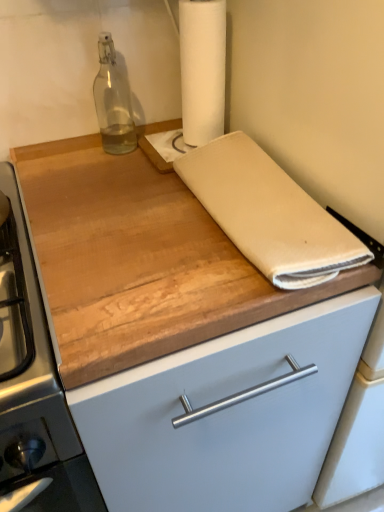
The width and height of the screenshot is (384, 512). In order to click on white paper towel at upper center in this screenshot , I will do `click(202, 69)`.

What do you see at coordinates (202, 69) in the screenshot?
I see `white paper towel at upper center` at bounding box center [202, 69].

What do you see at coordinates (269, 214) in the screenshot? This screenshot has width=384, height=512. I see `beige cotton towel at center` at bounding box center [269, 214].

The height and width of the screenshot is (512, 384). Identify the location of wooden cutting board at center. (139, 260).

Is transparent glass bottle at upper left surrounding wooden cutting board at center?

No, wooden cutting board at center is not surrounded by transparent glass bottle at upper left.

In the scene shown: From the image's perspective, is transparent glass bottle at upper left located above wooden cutting board at center?

Yes, from the image's perspective, transparent glass bottle at upper left is above wooden cutting board at center.

At what (x,y) coordinates should I click in order to perform the action: click on bottle to the left of wooden cutting board at center. Please return your answer as a coordinate pair (x, y). This screenshot has height=512, width=384. Looking at the image, I should click on (113, 101).

Consider the image. Considering their positions, is transparent glass bottle at upper left located in front of or behind wooden cutting board at center?

transparent glass bottle at upper left is positioned farther from the viewer than wooden cutting board at center.

Which object is positioned more to the left, transparent glass bottle at upper left or white paper towel at upper center?

transparent glass bottle at upper left.

From the image's perspective, relative to white paper towel at upper center, is transparent glass bottle at upper left above or below?

transparent glass bottle at upper left is below white paper towel at upper center.

Is transparent glass bottle at upper left positioned beyond the bounds of white paper towel at upper center?

That's correct, transparent glass bottle at upper left is outside of white paper towel at upper center.

Is transparent glass bottle at upper left with white paper towel at upper center?

No, transparent glass bottle at upper left is not next to white paper towel at upper center.

Is transparent glass bottle at upper left looking in the opposite direction of beige cotton towel at center?

transparent glass bottle at upper left is not turned away from beige cotton towel at center.

Is transparent glass bottle at upper left thinner than beige cotton towel at center?

Yes.

How far apart are transparent glass bottle at upper left and beige cotton towel at center?

transparent glass bottle at upper left and beige cotton towel at center are 14.42 inches apart.

Who is bigger, transparent glass bottle at upper left or beige cotton towel at center?

beige cotton towel at center is bigger.

Where is `linen on the right of the white paper towel at upper center`? The image size is (384, 512). linen on the right of the white paper towel at upper center is located at coordinates (269, 214).

Considering the sizes of objects beige cotton towel at center and white paper towel at upper center in the image provided, who is smaller, beige cotton towel at center or white paper towel at upper center?

Smaller between the two is white paper towel at upper center.

Is beige cotton towel at center spatially inside white paper towel at upper center, or outside of it?

beige cotton towel at center exists outside the volume of white paper towel at upper center.

Is beige cotton towel at center not close to wooden cutting board at center?

No.

Could you tell me if beige cotton towel at center is turned towards wooden cutting board at center?

Yes, beige cotton towel at center is turned towards wooden cutting board at center.

Considering the relative positions of beige cotton towel at center and wooden cutting board at center in the image provided, is beige cotton towel at center behind wooden cutting board at center?

Yes, it is.

From the picture: Which is closer, (199,22) or (307,281)?

Point (199,22).

Where is `paper towel on the left of the beige cotton towel at center`? This screenshot has width=384, height=512. paper towel on the left of the beige cotton towel at center is located at coordinates (202, 69).

Which object is positioned more to the left, white paper towel at upper center or beige cotton towel at center?

Positioned to the left is white paper towel at upper center.

From the image's perspective, which is below, white paper towel at upper center or beige cotton towel at center?

From the image's view, beige cotton towel at center is below.

Is white paper towel at upper center at the left side of wooden cutting board at center?

Incorrect, white paper towel at upper center is not on the left side of wooden cutting board at center.

Identify the location of countertop on the left of white paper towel at upper center. The image size is (384, 512). (139, 260).

Considering the sizes of objects white paper towel at upper center and wooden cutting board at center in the image provided, who is thinner, white paper towel at upper center or wooden cutting board at center?

white paper towel at upper center is thinner.

Between point (212, 100) and point (161, 210), which one is positioned in front?

Positioned in front is point (161, 210).

The height and width of the screenshot is (512, 384). I want to click on countertop in front of the transparent glass bottle at upper left, so click(x=139, y=260).

This screenshot has height=512, width=384. I want to click on bottle that is on the left side of white paper towel at upper center, so click(x=113, y=101).

Based on their spatial positions, is white paper towel at upper center or transparent glass bottle at upper left further from beige cotton towel at center?

The object further to beige cotton towel at center is transparent glass bottle at upper left.

Estimate the real-world distances between objects in this image. Which object is closer to beige cotton towel at center, transparent glass bottle at upper left or wooden cutting board at center?

The object closer to beige cotton towel at center is wooden cutting board at center.

Based on the photo, which object lies nearer to the anchor point beige cotton towel at center, wooden cutting board at center or transparent glass bottle at upper left?

Among the two, wooden cutting board at center is located nearer to beige cotton towel at center.

Which object lies nearer to the anchor point white paper towel at upper center, transparent glass bottle at upper left or wooden cutting board at center?

The object closer to white paper towel at upper center is transparent glass bottle at upper left.

Estimate the real-world distances between objects in this image. Which object is further from transparent glass bottle at upper left, beige cotton towel at center or wooden cutting board at center?

beige cotton towel at center lies further to transparent glass bottle at upper left than the other object.

Based on their spatial positions, is white paper towel at upper center or wooden cutting board at center further from transparent glass bottle at upper left?

wooden cutting board at center is further to transparent glass bottle at upper left.

Which object lies nearer to the anchor point wooden cutting board at center, transparent glass bottle at upper left or beige cotton towel at center?

The object closer to wooden cutting board at center is beige cotton towel at center.

Considering their positions, is wooden cutting board at center positioned closer to white paper towel at upper center than beige cotton towel at center?

beige cotton towel at center is positioned closer to the anchor white paper towel at upper center.

Locate an element on the screen. This screenshot has height=512, width=384. bottle between white paper towel at upper center and wooden cutting board at center in the up-down direction is located at coordinates (113, 101).

This screenshot has width=384, height=512. I want to click on paper towel located between beige cotton towel at center and transparent glass bottle at upper left in the depth direction, so click(202, 69).

The width and height of the screenshot is (384, 512). I want to click on linen between transparent glass bottle at upper left and wooden cutting board at center in the up-down direction, so click(269, 214).

The image size is (384, 512). I want to click on linen between white paper towel at upper center and wooden cutting board at center from top to bottom, so click(269, 214).